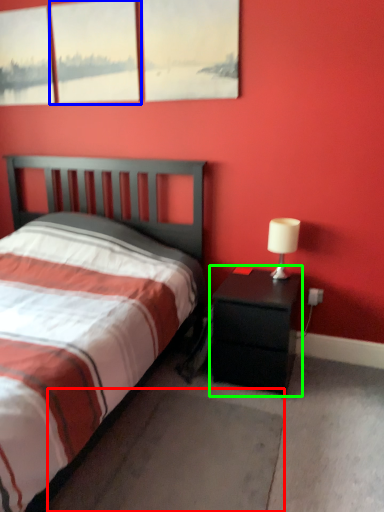
Question: Based on their relative distances, which object is farther from concrete (highlighted by a red box)? Choose from window (highlighted by a blue box) and nightstand (highlighted by a green box).

Choices:
 (A) window
 (B) nightstand

Answer: (A)